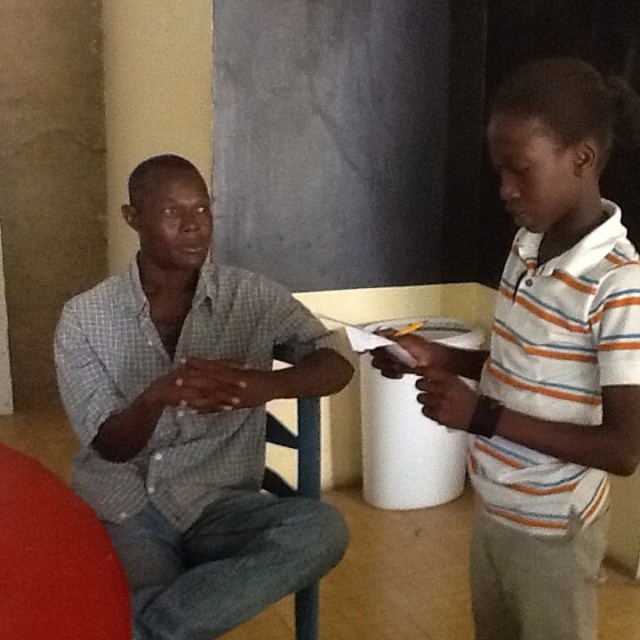
Based on the photo, is checkered fabric shirt at left wider than white striped shirt at right?

Yes, checkered fabric shirt at left is wider than white striped shirt at right.

Is checkered fabric shirt at left positioned at the back of white striped shirt at right?

Yes, checkered fabric shirt at left is further from the viewer.

Image resolution: width=640 pixels, height=640 pixels. What are the coordinates of `checkered fabric shirt at left` in the screenshot? It's located at (193, 417).